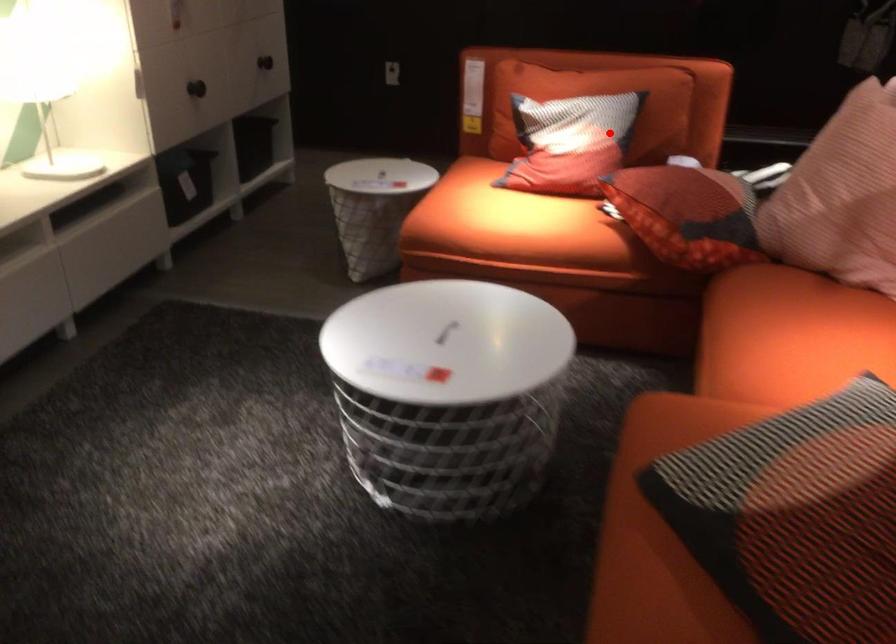
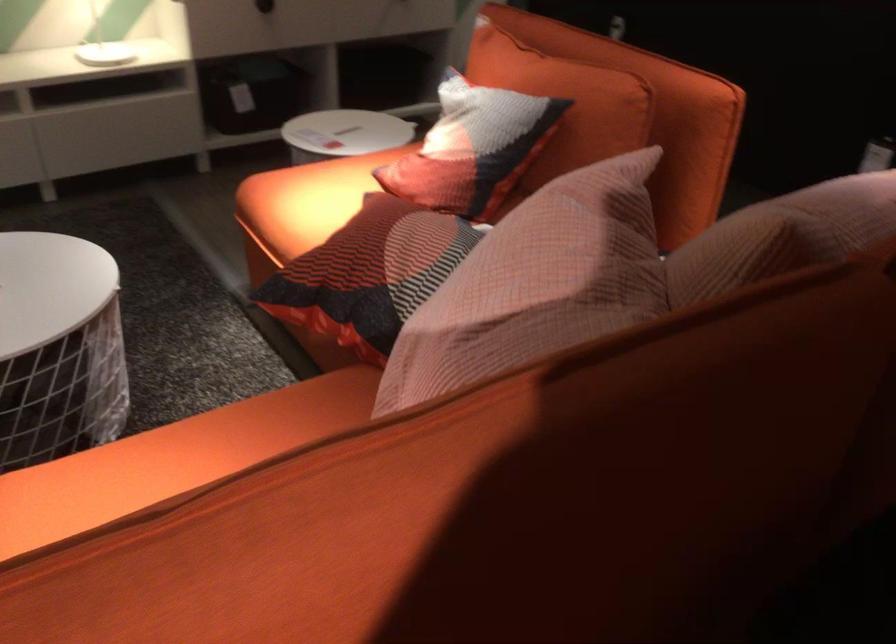
Question: A red point is marked in image1. In image2, is the corresponding 3D point closer to the camera or farther? Reply with the corresponding letter.

Choices:
 (A) The corresponding 3D point is closer.
 (B) The corresponding 3D point is farther.

Answer: (A)